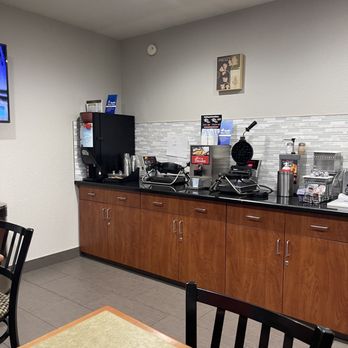
Locate an element on the screen. The width and height of the screenshot is (348, 348). counter top is located at coordinates (280, 202).